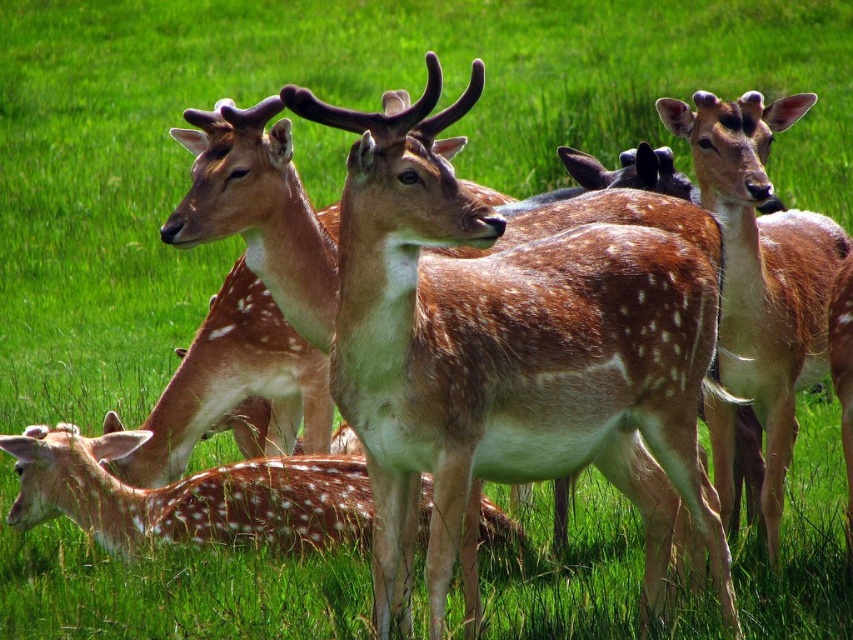
In the image of the deer in the green field, there are two types of fur patterns observed. The first is the brown speckled fur at center and the second is the brown spotted fur at center. Which of these two fur patterns is positioned lower in the image?

The brown speckled fur at center is located below the brown spotted fur at center, so the brown speckled fur at center is positioned lower in the image.

You are a wildlife photographer aiming to capture the tallest deer in the scene. Given the brown speckled fur at center and the spotted fur deer at center, which deer should you focus on to ensure you photograph the tallest one?

The brown speckled fur at center is taller than the spotted fur deer at center, so you should focus on the brown speckled fur at center to capture the tallest deer.

You are standing in a field and see a deer with brown spotted fur at center. If you want to take a photo of it without disturbing the deer, and your camera has a maximum zoom range of 4 meters, can you capture a clear photo from your current position?

The distance between you and the brown spotted fur at center is 4.10 meters. Since your camera can zoom up to 4 meters, you are slightly out of range and cannot capture a clear photo without moving closer.